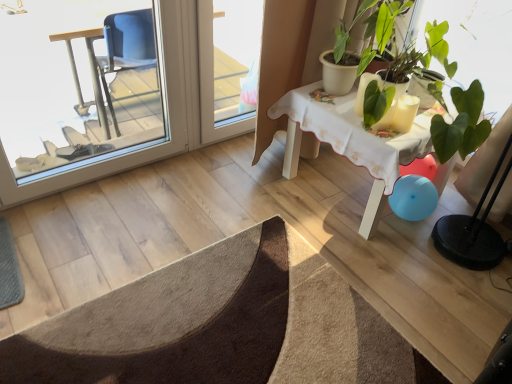
Locate an element on the screen. vacant space that is to the left of white wooden table at upper right is located at coordinates (233, 190).